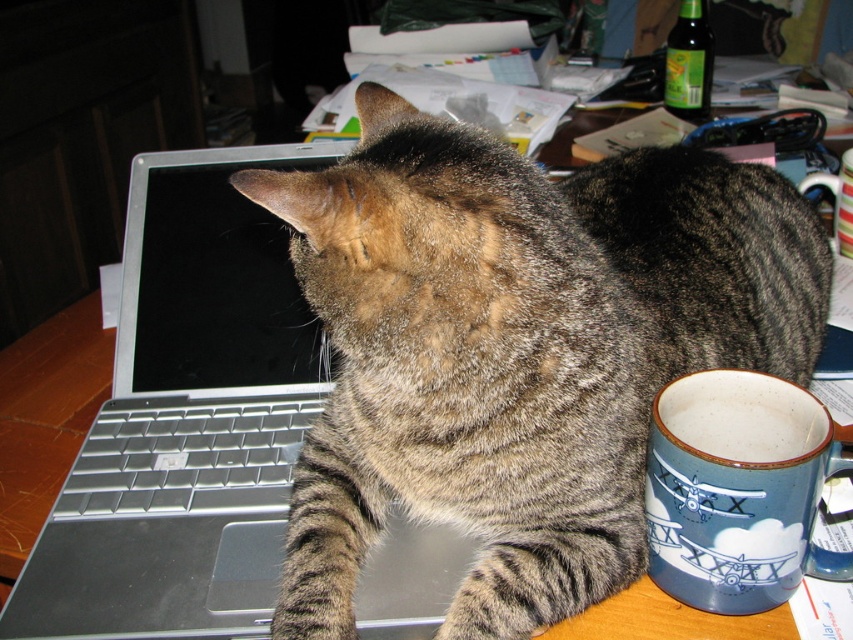
Which is more to the right, green glass bottle at upper center or blue ceramic mug at upper center?

Positioned to the right is blue ceramic mug at upper center.

Is green glass bottle at upper center smaller than blue ceramic mug at upper center?

Yes, green glass bottle at upper center is smaller than blue ceramic mug at upper center.

Who is more forward, [688,109] or [827,179]?

Point [827,179] is in front.

Find the location of a particular element. Image resolution: width=853 pixels, height=640 pixels. green glass bottle at upper center is located at coordinates (689, 64).

Can you confirm if silver metallic keyboard at center is bigger than blue ceramic mug at upper center?

Actually, silver metallic keyboard at center might be smaller than blue ceramic mug at upper center.

Between point (195, 481) and point (843, 208), which one is positioned in front?

Point (195, 481)

Where is `silver metallic keyboard at center`? This screenshot has width=853, height=640. silver metallic keyboard at center is located at coordinates (187, 460).

Is point (386, 579) positioned before point (849, 164)?

Yes.

You are a GUI agent. You are given a task and a screenshot of the screen. Output one action in this format:
    pyautogui.click(x=<x>, y=<y>)
    Task: Click on the silver metallic laptop at center
    This screenshot has height=640, width=853.
    Given the screenshot: What is the action you would take?
    pyautogui.click(x=186, y=419)